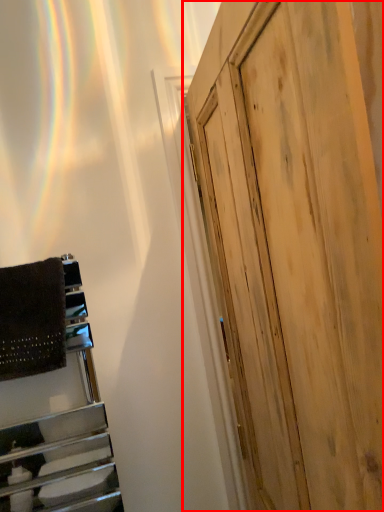
Question: From the image's perspective, what is the correct spatial positioning of door (annotated by the red box) in reference to blanket?

Choices:
 (A) below
 (B) above

Answer: (A)